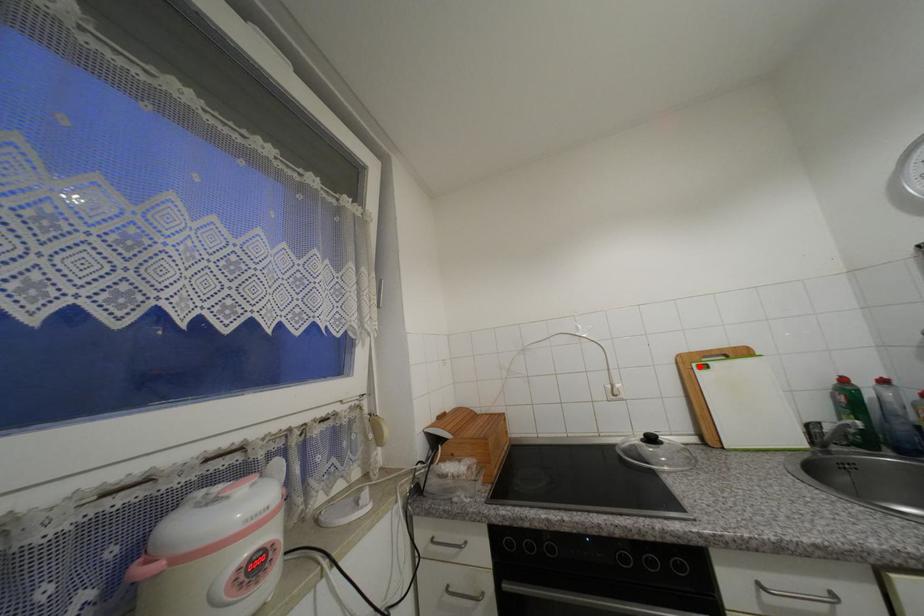
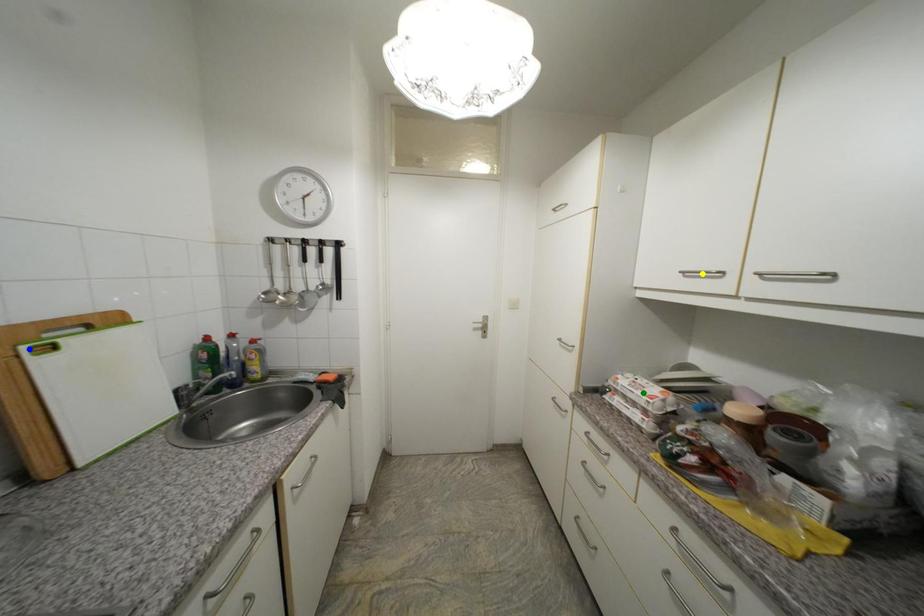
Question: I am providing you with two images of the same scene from different viewpoints. A red point is marked on the first image. You are given multiple points on the second image. Which spot in image 2 lines up with the point in image 1?

Choices:
 (A) yellow point
 (B) green point
 (C) blue point

Answer: (C)